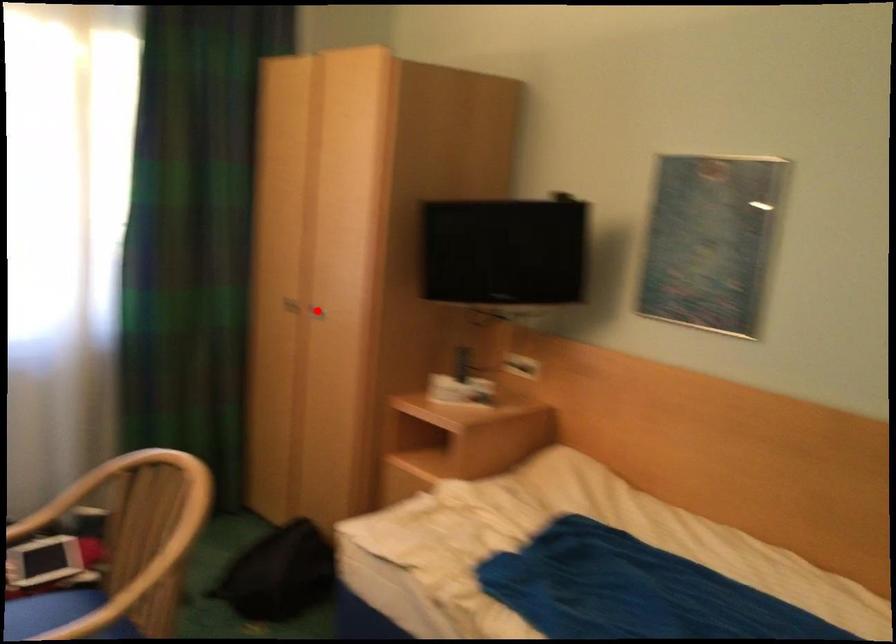
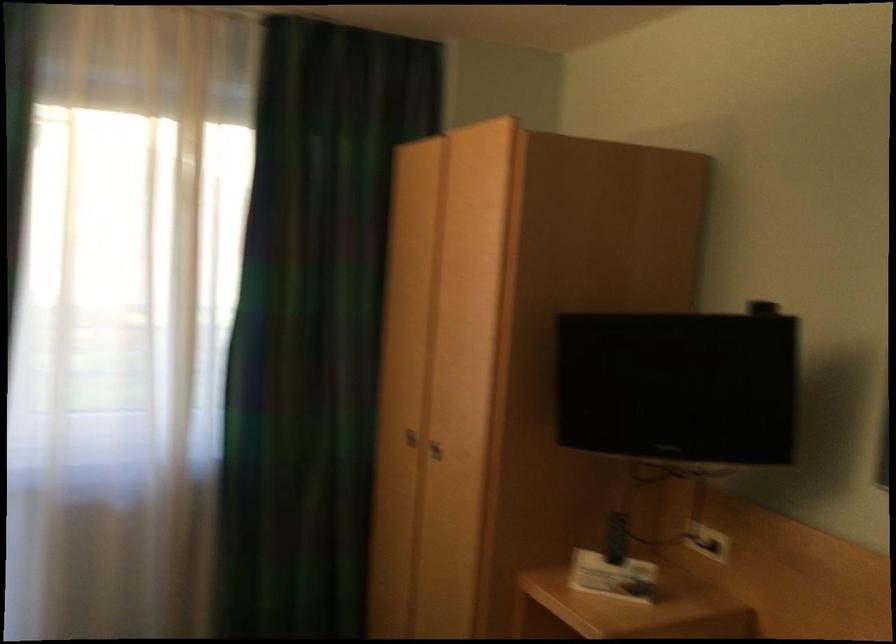
Locate, in the second image, the point that corresponds to the highlighted location in the first image.

(435, 450)